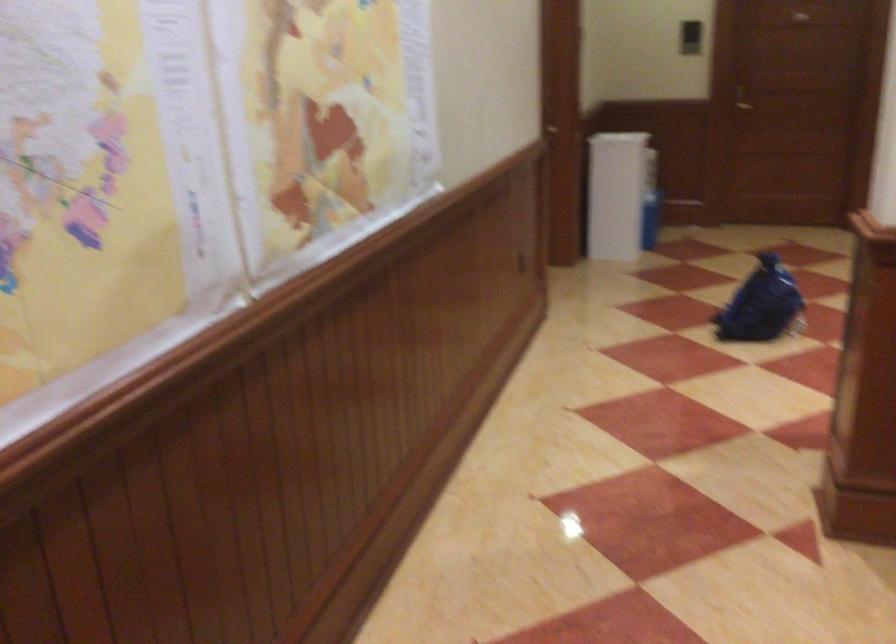
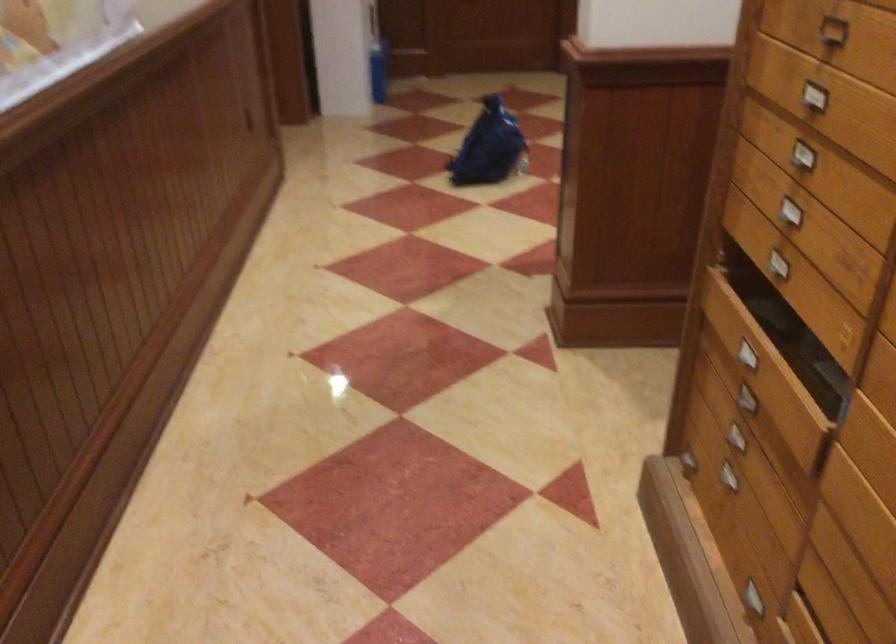
Find the pixel in the second image that matches [759,301] in the first image.

(488, 147)